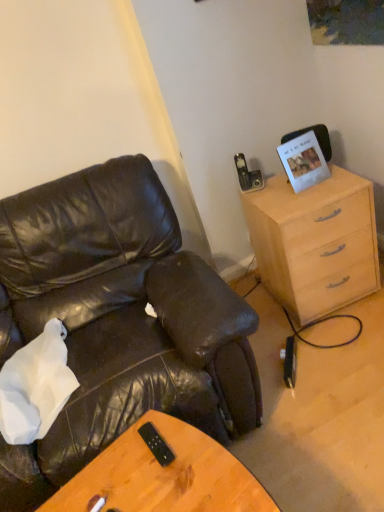
Locate an element on the screen. This screenshot has height=512, width=384. vacant area that is situated to the right of black plastic remote at center is located at coordinates [198, 450].